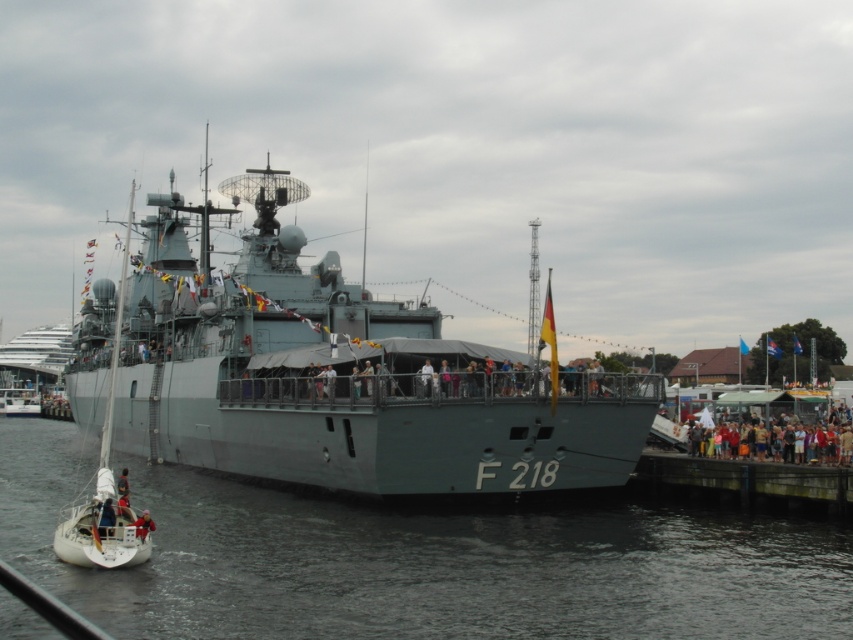
Question: Among these objects, which one is nearest to the camera?

Choices:
 (A) gray matte sailboat at left
 (B) multicolored casual clothing at lower right
 (C) light brown leather jacket at lower left
 (D) gray water at center

Answer: (D)

Question: Which of the following is the farthest from the observer?

Choices:
 (A) gray metallic ship at center
 (B) gray matte sailboat at left
 (C) light brown leather jacket at lower left
 (D) dark gray concrete dock at lower right

Answer: (D)

Question: Can you confirm if dark gray concrete dock at lower right is smaller than gray matte sailboat at left?

Choices:
 (A) no
 (B) yes

Answer: (B)

Question: Does gray water at center have a larger size compared to gray metallic ship at center?

Choices:
 (A) yes
 (B) no

Answer: (B)

Question: Estimate the real-world distances between objects in this image. Which object is farther from the gray matte sailboat at left?

Choices:
 (A) gray metallic ship at center
 (B) light brown leather jacket at lower left

Answer: (B)

Question: Can you confirm if multicolored casual clothing at lower right is positioned below light brown leather jacket at lower left?

Choices:
 (A) yes
 (B) no

Answer: (B)